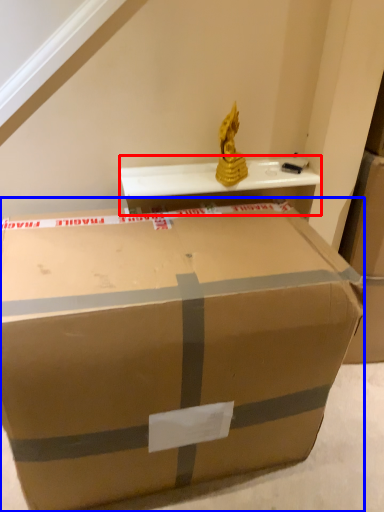
Question: Which of the following is the closest to the observer, table (highlighted by a red box) or box (highlighted by a blue box)?

Choices:
 (A) table
 (B) box

Answer: (B)